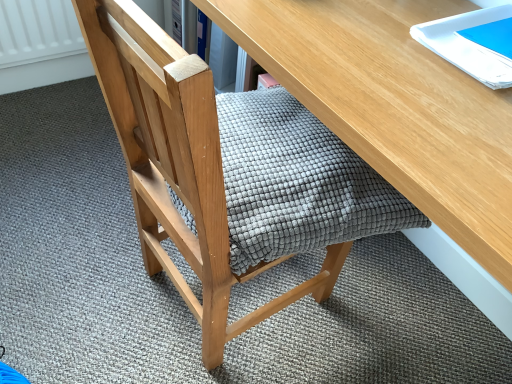
Image resolution: width=512 pixels, height=384 pixels. What do you see at coordinates (394, 105) in the screenshot?
I see `wooden desk at center` at bounding box center [394, 105].

Find the location of a particular element. Image resolution: width=512 pixels, height=384 pixels. wooden desk at center is located at coordinates (394, 105).

Which is behind, textured gray cushion at center or wooden desk at center?

textured gray cushion at center is further away from the camera.

From a real-world perspective, between textured gray cushion at center and wooden desk at center, who is vertically higher?

textured gray cushion at center, from a real-world perspective.

How many degrees apart are the facing directions of textured gray cushion at center and wooden desk at center?

The facing directions of textured gray cushion at center and wooden desk at center are 174 degrees apart.

Consider the image. Is textured gray cushion at center not within wooden desk at center?

That's incorrect, textured gray cushion at center is not completely outside wooden desk at center.

Is textured gray cushion at center facing away from white glossy notebook at upper right?

That's not correct — textured gray cushion at center is not looking away from white glossy notebook at upper right.

Which object is closer to the camera, textured gray cushion at center or white glossy notebook at upper right?

Positioned in front is textured gray cushion at center.

The height and width of the screenshot is (384, 512). I want to click on notebook on the right of textured gray cushion at center, so click(x=466, y=45).

Is point (151, 112) positioned before point (447, 34)?

Yes, point (151, 112) is closer to viewer.

Consider the image. Is white glossy notebook at upper right turned away from textured gray cushion at center?

white glossy notebook at upper right does not have its back to textured gray cushion at center.

Which is more to the left, white glossy notebook at upper right or textured gray cushion at center?

Positioned to the left is textured gray cushion at center.

Considering the sizes of objects white glossy notebook at upper right and textured gray cushion at center in the image provided, who is smaller, white glossy notebook at upper right or textured gray cushion at center?

With smaller size is white glossy notebook at upper right.

Is white glossy notebook at upper right beside textured gray cushion at center?

There is a gap between white glossy notebook at upper right and textured gray cushion at center.

How many degrees apart are the facing directions of wooden desk at center and textured gray cushion at center?

The facing directions of wooden desk at center and textured gray cushion at center are 174 degrees apart.

Is point (448, 222) closer or farther from the camera than point (344, 246)?

Point (448, 222) is positioned closer to the camera compared to point (344, 246).

Is wooden desk at center not close to textured gray cushion at center?

No, wooden desk at center is not far from textured gray cushion at center.

Based on the photo, is wooden desk at center thinner than textured gray cushion at center?

In fact, wooden desk at center might be wider than textured gray cushion at center.

From a real-world perspective, is wooden desk at center located beneath white glossy notebook at upper right?

Yes, from a real-world perspective, wooden desk at center is beneath white glossy notebook at upper right.

Considering the sizes of wooden desk at center and white glossy notebook at upper right in the image, is wooden desk at center taller or shorter than white glossy notebook at upper right?

wooden desk at center is taller than white glossy notebook at upper right.

Which object is wider, wooden desk at center or white glossy notebook at upper right?

Wider between the two is wooden desk at center.

Can you confirm if white glossy notebook at upper right is taller than wooden desk at center?

No, white glossy notebook at upper right is not taller than wooden desk at center.

Considering the sizes of white glossy notebook at upper right and wooden desk at center in the image, is white glossy notebook at upper right bigger or smaller than wooden desk at center?

white glossy notebook at upper right is smaller than wooden desk at center.

Does point (471, 54) appear closer or farther from the camera than point (291, 11)?

Point (471, 54) is closer to the camera than point (291, 11).

I want to click on chair above the wooden desk at center (from a real-world perspective), so click(178, 164).

The width and height of the screenshot is (512, 384). Identify the location of notebook located on the right of textured gray cushion at center. (466, 45).

Based on the photo, based on their spatial positions, is textured gray cushion at center or wooden desk at center further from white glossy notebook at upper right?

Among the two, textured gray cushion at center is located further to white glossy notebook at upper right.

When comparing their distances from wooden desk at center, does textured gray cushion at center or white glossy notebook at upper right seem further?

The object further to wooden desk at center is textured gray cushion at center.

Based on their spatial positions, is white glossy notebook at upper right or wooden desk at center closer to textured gray cushion at center?

Among the two, wooden desk at center is located nearer to textured gray cushion at center.

Considering their positions, is white glossy notebook at upper right positioned closer to wooden desk at center than textured gray cushion at center?

white glossy notebook at upper right lies closer to wooden desk at center than the other object.

From the picture: When comparing their distances from textured gray cushion at center, does wooden desk at center or white glossy notebook at upper right seem closer?

Among the two, wooden desk at center is located nearer to textured gray cushion at center.

In the scene shown: Based on their spatial positions, is wooden desk at center or textured gray cushion at center further from white glossy notebook at upper right?

textured gray cushion at center is further to white glossy notebook at upper right.

Identify the location of desk between textured gray cushion at center and white glossy notebook at upper right from left to right. The height and width of the screenshot is (384, 512). point(394,105).